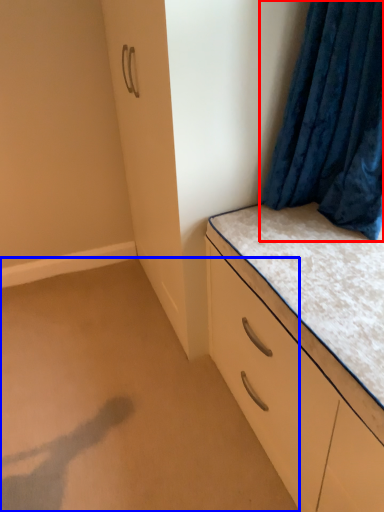
Question: Which object appears farthest to the camera in this image, curtain (highlighted by a red box) or plain (highlighted by a blue box)?

Choices:
 (A) curtain
 (B) plain

Answer: (B)